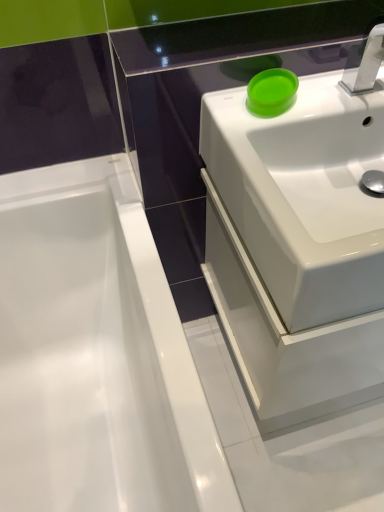
Image resolution: width=384 pixels, height=512 pixels. I want to click on vacant region to the left of silver metallic tap at upper right, so click(315, 100).